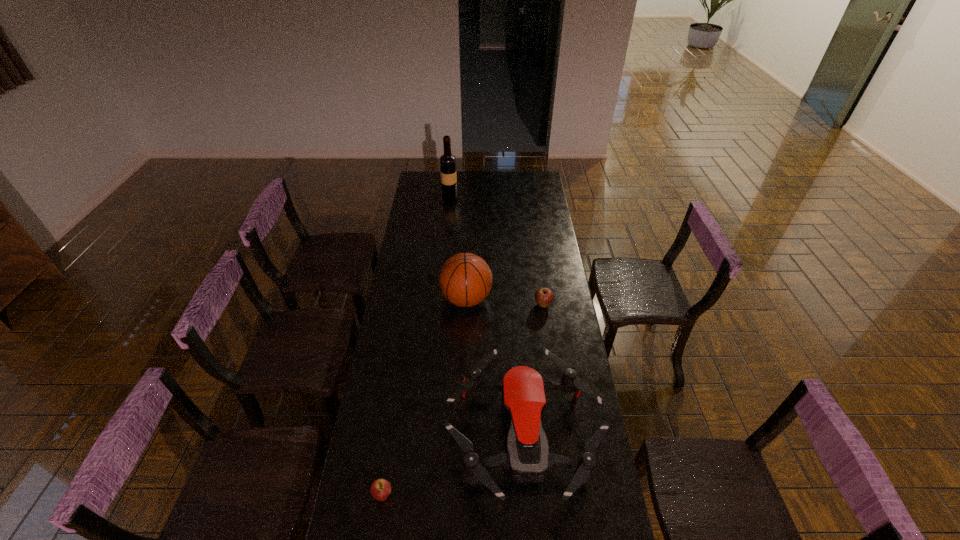
At what (x,y) coordinates should I click in order to perform the action: click on vacant space that satisfies the following two spatial constraints: 1. on the front side of the second tallest object; 2. on the right side of the farther apple. Please return your answer as a coordinate pair (x, y). The width and height of the screenshot is (960, 540). Looking at the image, I should click on (466, 305).

Image resolution: width=960 pixels, height=540 pixels. What are the coordinates of `free region that satisfies the following two spatial constraints: 1. on the front side of the farthest object; 2. on the right side of the farther apple` in the screenshot? It's located at (440, 305).